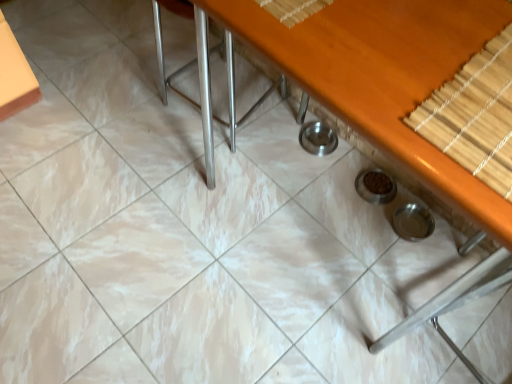
Question: From their relative heights in the image, would you say bamboo mat at upper right is taller or shorter than satin silver chair at center?

Choices:
 (A) tall
 (B) short

Answer: (B)

Question: From a real-world perspective, relative to satin silver chair at center, is bamboo mat at upper right vertically above or below?

Choices:
 (A) below
 (B) above

Answer: (B)

Question: Which object is positioned closest to the satin silver chair at center?

Choices:
 (A) bamboo mat at upper right
 (B) wooden table at center

Answer: (B)

Question: Which is farther from the satin silver chair at center?

Choices:
 (A) wooden table at center
 (B) bamboo mat at upper right

Answer: (B)